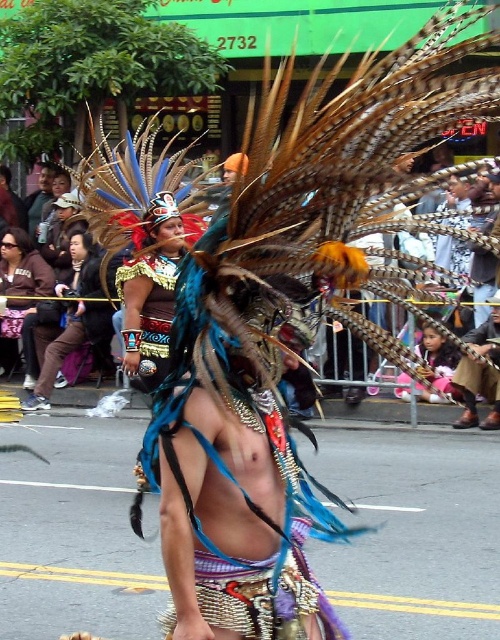
You are a photographer standing in the street scene and want to take a photo of both the leather boots at lower right and the matte black headdress at center. Which object should you focus on first to ensure both are in sharp focus?

You should focus on the leather boots at lower right first because it is closer to the viewer than the matte black headdress at center, so adjusting focus from near to far will help both objects be in sharp focus.

You are a photographer standing at the lower right corner of the scene. You want to capture a photo that includes both the leather boots at lower right and the matte black headdress at center. Given that your camera has a maximum focal length of 5 meters, will you be able to include both objects in the same frame without moving?

The distance between the leather boots at lower right and the matte black headdress at center is 8.14 meters, which exceeds the camera maximum focal length of 5 meters. Therefore, you cannot include both objects in the same frame without moving.